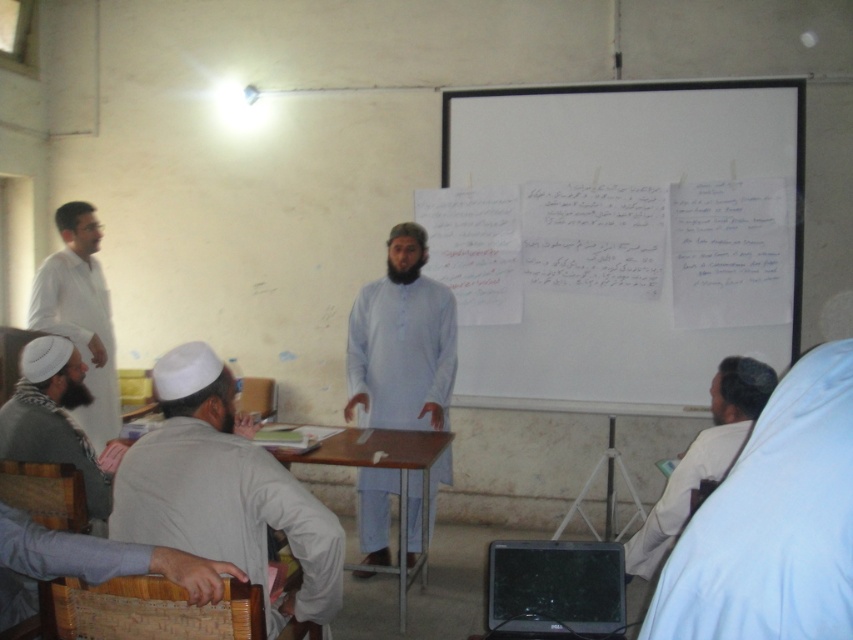
Consider the image. Is light gray cotton shirt at lower left to the left of white cloth at lower right from the viewer's perspective?

Indeed, light gray cotton shirt at lower left is positioned on the left side of white cloth at lower right.

Can you confirm if light gray cotton shirt at lower left is bigger than white cloth at lower right?

No.

Image resolution: width=853 pixels, height=640 pixels. Describe the element at coordinates (222, 490) in the screenshot. I see `light gray cotton shirt at lower left` at that location.

You are a GUI agent. You are given a task and a screenshot of the screen. Output one action in this format:
    pyautogui.click(x=<x>, y=<y>)
    Task: Click on the light gray cotton shirt at lower left
    The height and width of the screenshot is (640, 853).
    Given the screenshot: What is the action you would take?
    pyautogui.click(x=222, y=490)

Can you confirm if light blue cotton shirt at center is wider than white matte shirt at left?

Yes, light blue cotton shirt at center is wider than white matte shirt at left.

Locate an element on the screen. The width and height of the screenshot is (853, 640). light blue cotton shirt at center is located at coordinates (401, 340).

The height and width of the screenshot is (640, 853). Describe the element at coordinates (222, 490) in the screenshot. I see `light gray cotton shirt at lower left` at that location.

What are the coordinates of `light gray cotton shirt at lower left` in the screenshot? It's located at (222, 490).